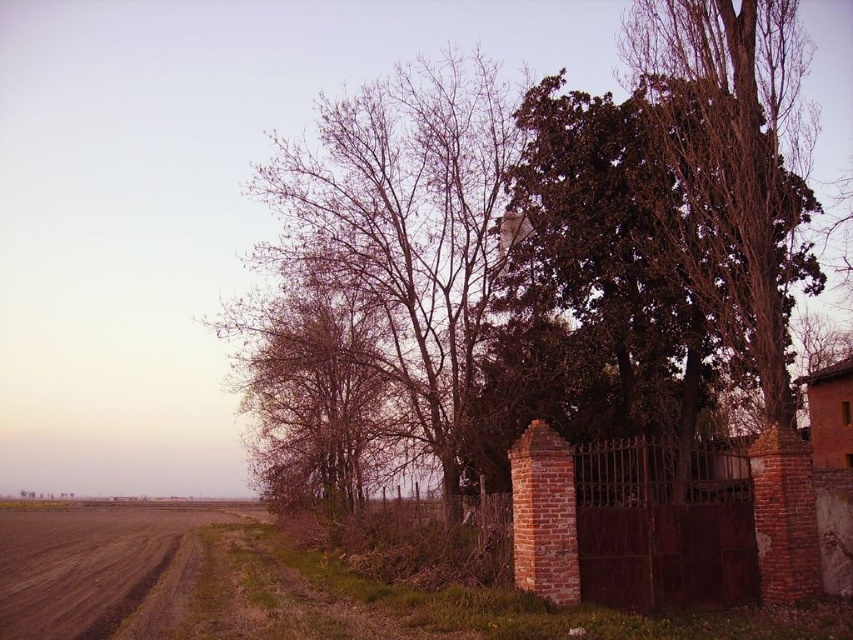
You are an artist trying to sketch this scene. You notice the bare branches at center and the brown dirt track at lower left. Which object would you need to draw with finer details to capture their thickness accurately?

The bare branches at center are thinner than the brown dirt track at lower left, so you should draw the bare branches at center with finer details to accurately represent their thickness.

You are standing at the edge of the brown dirt track at lower left and want to see the bare branches at center. Which direction should you look to see the taller object?

The bare branches at center are taller than the brown dirt track at lower left. Since you are on the brown dirt track at lower left, you should look towards the center of the image to see the taller bare branches at center.

You are standing at the edge of the field and want to walk along the dirt path. Which object, the bare branches at center or the brown dirt track at lower left, is closer to you?

The brown dirt track at lower left is behind the bare branches at center, so the bare branches at center are closer to you.